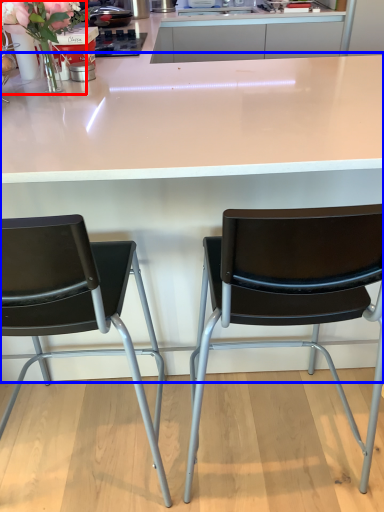
Question: Among these objects, which one is nearest to the camera, floral arrangement (highlighted by a red box) or table (highlighted by a blue box)?

Choices:
 (A) floral arrangement
 (B) table

Answer: (B)